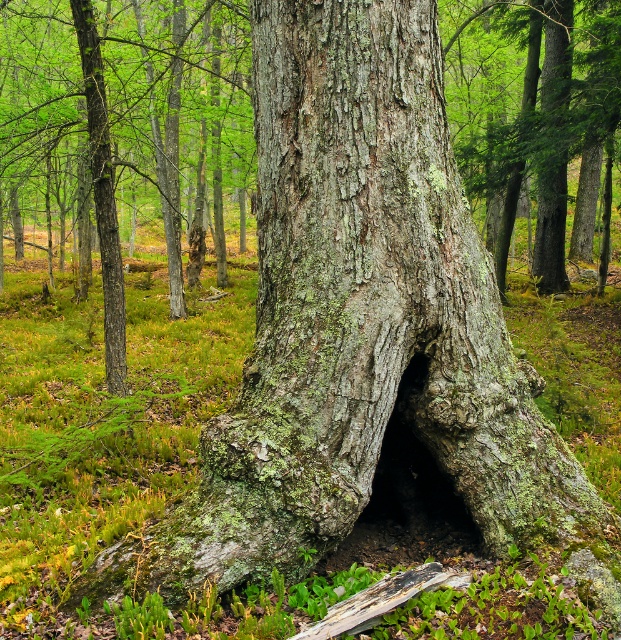
Question: Which point is farther to the camera?

Choices:
 (A) green mossy tree trunk at center
 (B) green mossy log at center

Answer: (A)

Question: Considering the relative positions of green mossy bark tree at center and green mossy log at center in the image provided, where is green mossy bark tree at center located with respect to green mossy log at center?

Choices:
 (A) above
 (B) below

Answer: (A)

Question: Is green mossy bark tree at center closer to camera compared to green mossy tree trunk at center?

Choices:
 (A) yes
 (B) no

Answer: (A)

Question: Can you confirm if green mossy tree trunk at center is positioned above green mossy log at center?

Choices:
 (A) no
 (B) yes

Answer: (B)

Question: Which of the following is the closest to the observer?

Choices:
 (A) (569, 29)
 (B) (463, 572)

Answer: (B)

Question: Which of the following is the farthest from the observer?

Choices:
 (A) green mossy tree trunk at center
 (B) green mossy log at center

Answer: (A)